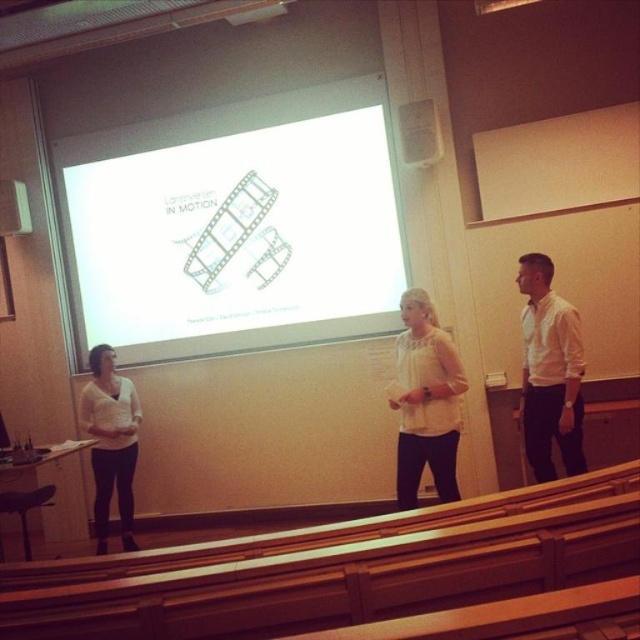
Question: Estimate the real-world distances between objects in this image. Which object is closer to the white matte blouse at center?

Choices:
 (A) white shirt at right
 (B) white matte shirt at center

Answer: (A)

Question: From the image, what is the correct spatial relationship of white matte blouse at center in relation to white matte shirt at center?

Choices:
 (A) right
 (B) left

Answer: (A)

Question: Which of the following is the closest to the observer?

Choices:
 (A) white matte projection screen at center
 (B) white matte shirt at center
 (C) white shirt at right
 (D) white matte blouse at center

Answer: (D)

Question: Is white shirt at right wider than white matte shirt at center?

Choices:
 (A) yes
 (B) no

Answer: (B)

Question: Can you confirm if white shirt at right is positioned to the right of white matte shirt at center?

Choices:
 (A) yes
 (B) no

Answer: (A)

Question: Which object is positioned farthest from the white matte projection screen at center?

Choices:
 (A) white shirt at right
 (B) white matte shirt at center

Answer: (A)